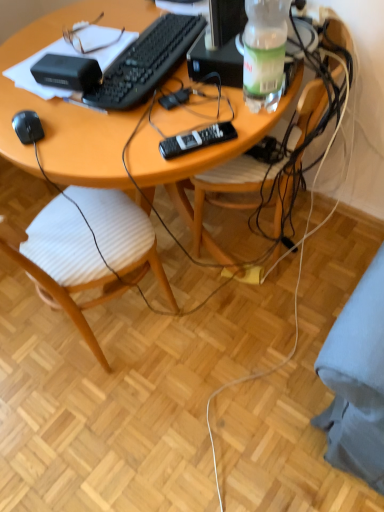
Find the location of a particular element. This screenshot has width=384, height=512. wooden chair at center, marked as the 2th chair in a left-to-right arrangement is located at coordinates (224, 192).

What do you see at coordinates (27, 127) in the screenshot?
I see `black matte computer mouse at lower left` at bounding box center [27, 127].

The width and height of the screenshot is (384, 512). Describe the element at coordinates (89, 37) in the screenshot. I see `brown plastic glasses at upper left` at that location.

Image resolution: width=384 pixels, height=512 pixels. Describe the element at coordinates (69, 106) in the screenshot. I see `wooden chair at center, which is counted as the second chair, starting from the right` at that location.

This screenshot has height=512, width=384. Describe the element at coordinates (264, 53) in the screenshot. I see `clear plastic bottle at upper right` at that location.

At what (x,y) coordinates should I click in order to perform the action: click on wooden chair at center, marked as the 2th chair in a left-to-right arrangement. Please return your answer as a coordinate pair (x, y). This screenshot has width=384, height=512. Looking at the image, I should click on (224, 192).

From the image's perspective, between black matte keyboard at center and black matte computer mouse at lower left, who is located below?

From the image's view, black matte computer mouse at lower left is below.

Is the position of black matte keyboard at center less distant than that of black matte computer mouse at lower left?

No, black matte keyboard at center is behind black matte computer mouse at lower left.

Choose the correct answer: Is black matte keyboard at center inside black matte computer mouse at lower left or outside it?

The correct answer is: outside.

Is black matte keyboard at center shorter than black matte computer mouse at lower left?

Indeed, black matte keyboard at center has a lesser height compared to black matte computer mouse at lower left.

Is wooden desk at center far from clear plastic bottle at upper right?

No, wooden desk at center is not far from clear plastic bottle at upper right.

Based on the photo, how far apart are wooden desk at center and clear plastic bottle at upper right?

13.65 inches.

Is wooden desk at center spatially inside clear plastic bottle at upper right, or outside of it?

wooden desk at center exists outside the volume of clear plastic bottle at upper right.

Is the position of wooden desk at center less distant than that of clear plastic bottle at upper right?

No, wooden desk at center is further to the viewer.

Is clear plastic bottle at upper right wider or thinner than wooden chair at center, marked as the 2th chair in a left-to-right arrangement?

In the image, clear plastic bottle at upper right appears to be more narrow than wooden chair at center, marked as the 2th chair in a left-to-right arrangement.

From a real-world perspective, is clear plastic bottle at upper right physically located above or below wooden chair at center, the first chair from the right?

From a real-world perspective, clear plastic bottle at upper right is physically above wooden chair at center, the first chair from the right.

Is clear plastic bottle at upper right far away from wooden chair at center, marked as the 2th chair in a left-to-right arrangement?

clear plastic bottle at upper right is near wooden chair at center, marked as the 2th chair in a left-to-right arrangement, not far away.

From their relative heights in the image, would you say black matte computer mouse at lower left is taller or shorter than wooden chair at center, which is counted as the second chair, starting from the right?

Considering their sizes, black matte computer mouse at lower left has less height than wooden chair at center, which is counted as the second chair, starting from the right.

From the image's perspective, which object appears higher, black matte computer mouse at lower left or wooden chair at center, marked as the first chair in a left-to-right arrangement?

black matte computer mouse at lower left.

In order to click on computer mouse lying behind the wooden chair at center, which is counted as the second chair, starting from the right in this screenshot , I will do `click(27, 127)`.

How many degrees apart are the facing directions of black matte computer mouse at lower left and wooden chair at center, marked as the first chair in a left-to-right arrangement?

The angular difference between black matte computer mouse at lower left and wooden chair at center, marked as the first chair in a left-to-right arrangement, is 113 degrees.

Are black matte keyboard at center and wooden chair at center, the first chair from the right, far apart?

They are positioned close to each other.

Would you say black matte keyboard at center is to the left or to the right of wooden chair at center, the first chair from the right, in the picture?

Clearly, black matte keyboard at center is on the left of wooden chair at center, the first chair from the right, in the image.

Which point is more forward, (146, 44) or (276, 221)?

The point (146, 44) is closer.

Considering the sizes of objects black matte keyboard at center and wooden chair at center, the first chair from the right, in the image provided, who is shorter, black matte keyboard at center or wooden chair at center, the first chair from the right,?

With less height is black matte keyboard at center.

Would you say wooden chair at center, marked as the 2th chair in a left-to-right arrangement, is to the left or to the right of clear plastic bottle at upper right in the picture?

wooden chair at center, marked as the 2th chair in a left-to-right arrangement, is positioned on clear plastic bottle at upper right's right side.

Is wooden chair at center, marked as the 2th chair in a left-to-right arrangement, positioned before clear plastic bottle at upper right?

No.

You are a GUI agent. You are given a task and a screenshot of the screen. Output one action in this format:
    pyautogui.click(x=<x>, y=<y>)
    Task: Click on the 2nd chair behind the clear plastic bottle at upper right, counting from the anchor's position
    
    Given the screenshot: What is the action you would take?
    pyautogui.click(x=224, y=192)

Is wooden chair at center, the first chair from the right, far from clear plastic bottle at upper right?

wooden chair at center, the first chair from the right, is actually quite close to clear plastic bottle at upper right.

Is black matte keyboard at center thinner than brown plastic glasses at upper left?

No, black matte keyboard at center is not thinner than brown plastic glasses at upper left.

Does point (180, 30) appear closer or farther from the camera than point (74, 36)?

Clearly, point (180, 30) is closer to the camera than point (74, 36).

Is black matte keyboard at center situated inside brown plastic glasses at upper left or outside?

The correct answer is: outside.

Considering the relative positions of black matte keyboard at center and brown plastic glasses at upper left in the image provided, is black matte keyboard at center in front of brown plastic glasses at upper left?

Yes, it is.

The image size is (384, 512). Find the location of `computer keyboard above the black matte computer mouse at lower left (from the image's perspective)`. computer keyboard above the black matte computer mouse at lower left (from the image's perspective) is located at coordinates (146, 62).

The width and height of the screenshot is (384, 512). I want to click on desk on the left of clear plastic bottle at upper right, so click(x=71, y=105).

Looking at the image, which one is located further to black matte computer mouse at lower left, brown plastic glasses at upper left or wooden chair at center, the first chair from the right?

wooden chair at center, the first chair from the right, is positioned further to the anchor black matte computer mouse at lower left.

In the scene shown: Estimate the real-world distances between objects in this image. Which object is further from black matte keyboard at center, wooden desk at center or brown plastic glasses at upper left?

brown plastic glasses at upper left is positioned further to the anchor black matte keyboard at center.

When comparing their distances from black matte computer mouse at lower left, does black matte keyboard at center or brown plastic glasses at upper left seem further?

Based on the image, brown plastic glasses at upper left appears to be further to black matte computer mouse at lower left.

Which object lies nearer to the anchor point brown plastic glasses at upper left, wooden desk at center or wooden chair at center, which is counted as the second chair, starting from the right?

Based on the image, wooden desk at center appears to be nearer to brown plastic glasses at upper left.

Looking at the image, which one is located closer to black matte keyboard at center, black matte computer mouse at lower left or wooden chair at center, the first chair from the right?

Based on the image, black matte computer mouse at lower left appears to be nearer to black matte keyboard at center.

When comparing their distances from wooden chair at center, which is counted as the second chair, starting from the right, does black plastic remote at center or clear plastic bottle at upper right seem closer?

black plastic remote at center is positioned closer to the anchor wooden chair at center, which is counted as the second chair, starting from the right.

Which object lies nearer to the anchor point black matte keyboard at center, clear plastic bottle at upper right or black plastic remote at center?

→ black plastic remote at center.

Looking at the image, which one is located closer to black matte keyboard at center, wooden chair at center, which is counted as the second chair, starting from the right, or black plastic remote at center?

wooden chair at center, which is counted as the second chair, starting from the right, is positioned closer to the anchor black matte keyboard at center.

Where is `chair between black matte computer mouse at lower left and black plastic remote at center in the horizontal direction`? The image size is (384, 512). chair between black matte computer mouse at lower left and black plastic remote at center in the horizontal direction is located at coordinates pos(69,106).

In order to click on mobile phone between black matte keyboard at center and wooden chair at center, the first chair from the right in this screenshot , I will do `click(196, 140)`.

Locate an element on the screen. Image resolution: width=384 pixels, height=512 pixels. mobile phone located between clear plastic bottle at upper right and wooden chair at center, marked as the 2th chair in a left-to-right arrangement, in the depth direction is located at coordinates (196, 140).

Find the location of a particular element. Image resolution: width=384 pixels, height=512 pixels. desk between brown plastic glasses at upper left and black matte computer mouse at lower left in the vertical direction is located at coordinates (71, 105).